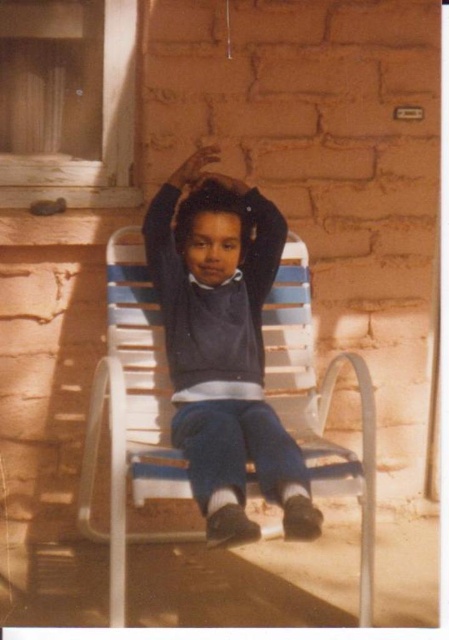
Based on the photo, can you confirm if matte blue pants at center is positioned below white plastic chair at center?

No, matte blue pants at center is not below white plastic chair at center.

Between point (184, 296) and point (274, 304), which one is positioned behind?

The point (274, 304) is more distant.

Is point (273, 426) more distant than point (304, 433)?

No, (273, 426) is closer to viewer.

The width and height of the screenshot is (449, 640). What are the coordinates of `matte blue pants at center` in the screenshot? It's located at (224, 352).

Describe the element at coordinates (131, 413) in the screenshot. The image size is (449, 640). I see `white plastic chair at center` at that location.

This screenshot has height=640, width=449. Identify the location of white plastic chair at center. (131, 413).

Identify the location of white plastic chair at center. (131, 413).

Locate an element on the screen. The image size is (449, 640). matte blue pants at center is located at coordinates (224, 352).

Is point (225, 422) positioned in front of point (198, 168)?

Yes, it is.

Where is `matte blue pants at center`? matte blue pants at center is located at coordinates (224, 352).

This screenshot has height=640, width=449. In order to click on matte blue pants at center in this screenshot , I will do `click(224, 352)`.